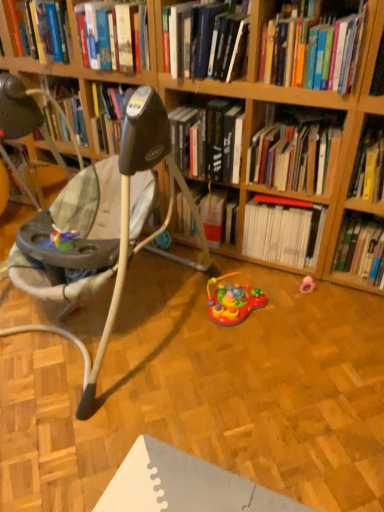
Locate an element on the screen. Image resolution: width=384 pixels, height=512 pixels. vacant space that is in between multicolored plastic toy at center, marked as the second toy in a right-to-left arrangement, and pink rubber pacifier at lower right, which is the first toy from right to left is located at coordinates (283, 301).